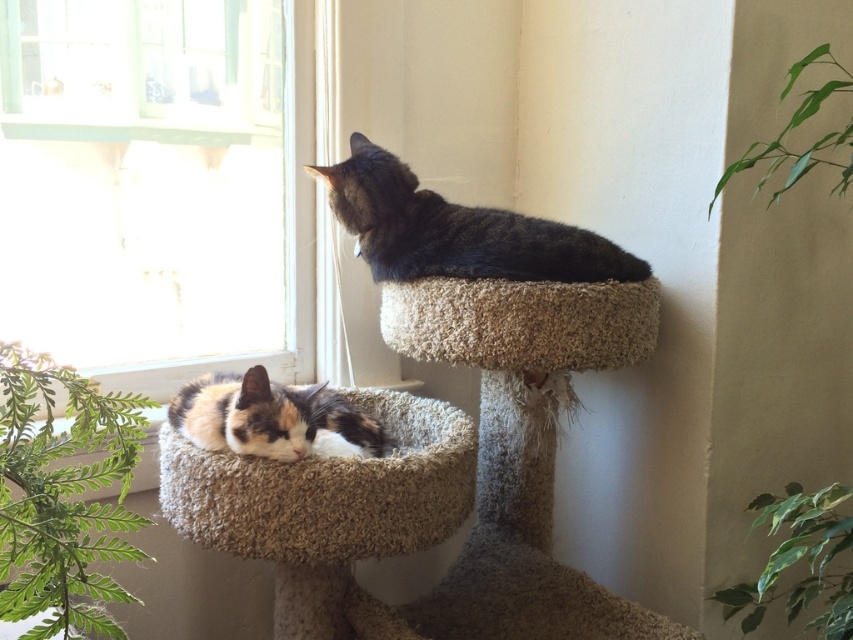
You are a cat owner who wants to place a new toy on the beige carpeted cat bed at lower left. To avoid blocking the view through the clear glass window at upper left, where should you place the toy?

Place the toy on the beige carpeted cat bed at lower left towards the front edge so it doesn t block the clear glass window at upper left which is positioned over it.

From the picture: You are a cat owner who wants to place a new toy on the beige carpeted cat bed at upper center. If your hand can reach up to 3 feet, will you be able to place the toy without moving closer to the cat tree?

The distance between the beige carpeted cat bed at upper center and the camera is 4.11 feet. Since your hand can only reach up to 3 feet, you cannot place the toy without moving closer to the cat tree.

You are a cat owner who wants to ensure your cats have enough space to stretch out on the cat tree. The cat tree has two levels. The calico cat is on the lower level, and the dark brown cat is on the upper level. Which cat is closer to the clear glass window at upper left located at point [154,186]?

The dark brown cat on the upper level is closer to the clear glass window at upper left located at point [154,186] because the upper level of the cat tree is positioned closer to the window than the lower level.